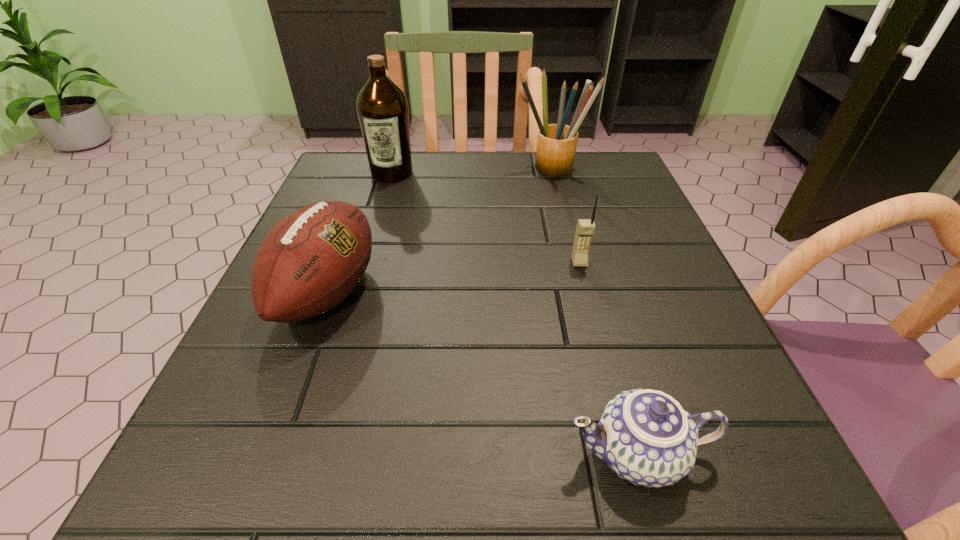
This screenshot has height=540, width=960. Find the location of `olive oil`. olive oil is located at coordinates (382, 108).

At what (x,y) coordinates should I click in order to perform the action: click on pencil box. Please return your answer as a coordinate pair (x, y). The width and height of the screenshot is (960, 540). Looking at the image, I should click on (556, 143).

Where is `football (American)`? The height and width of the screenshot is (540, 960). football (American) is located at coordinates (311, 260).

I want to click on cellular telephone, so click(x=585, y=228).

Find the location of a particular element. This screenshot has width=960, height=540. the nearest object is located at coordinates (644, 436).

You are a GUI agent. You are given a task and a screenshot of the screen. Output one action in this format:
    pyautogui.click(x=<x>, y=<y>)
    Task: Click on the chinaware
    Image resolution: width=960 pixels, height=540 pixels.
    Given the screenshot: What is the action you would take?
    pyautogui.click(x=644, y=436)

Identify the location of free space located on the label of the olive oil. (383, 204).

Identify the location of free point located on the left of the pencil box. Image resolution: width=960 pixels, height=540 pixels. (396, 169).

Where is `free space located 0.060m on the back of the football (American)`? free space located 0.060m on the back of the football (American) is located at coordinates (351, 226).

Identify the location of vacant space situated 0.150m on the front of the cellular telephone, where the keypad is located. (597, 333).